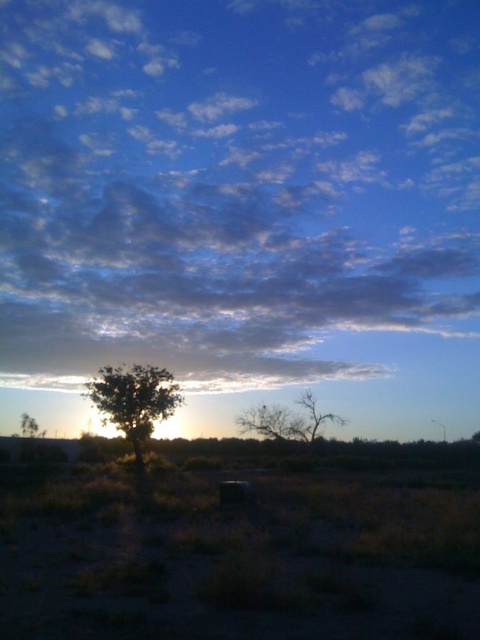
Question: Observing the image, what is the correct spatial positioning of cloudy blue sky at upper center in reference to green matte tree at left?

Choices:
 (A) right
 (B) left

Answer: (A)

Question: Does brown/dry wood tree at center have a larger size compared to green matte tree at left?

Choices:
 (A) no
 (B) yes

Answer: (B)

Question: Which object is the farthest from the silhouette bare tree at center?

Choices:
 (A) brown/dry wood tree at center
 (B) green matte tree at left
 (C) cloudy blue sky at upper center

Answer: (C)

Question: Is green leafy tree at center above brown/dry wood tree at center?

Choices:
 (A) yes
 (B) no

Answer: (A)

Question: Among these objects, which one is farthest from the camera?

Choices:
 (A) cloudy blue sky at upper center
 (B) brown textured tree at center

Answer: (A)

Question: Which point appears closest to the camera in this image?

Choices:
 (A) (327, 412)
 (B) (31, 429)
 (C) (285, 416)

Answer: (C)